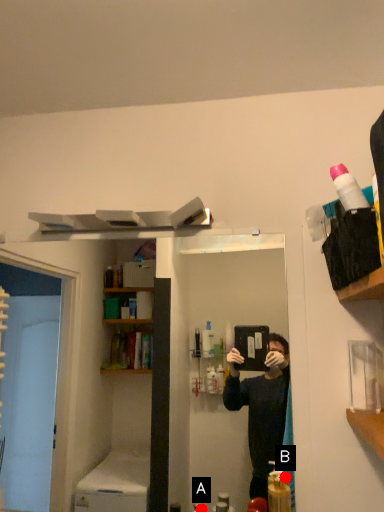
Question: Two points are circled on the image, labeled by A and B beside each circle. Among these points, which one is farthest from the camera?

Choices:
 (A) A is further
 (B) B is further

Answer: (A)